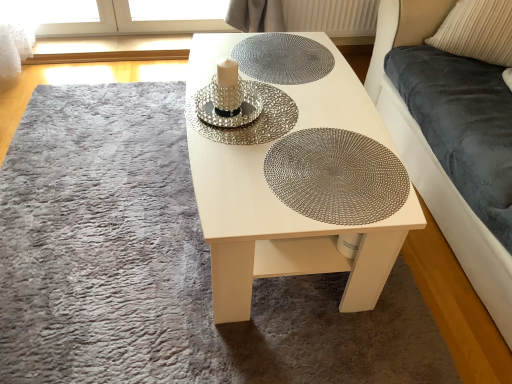
Identify the location of vacant space that is to the left of white wood table at center. (103, 192).